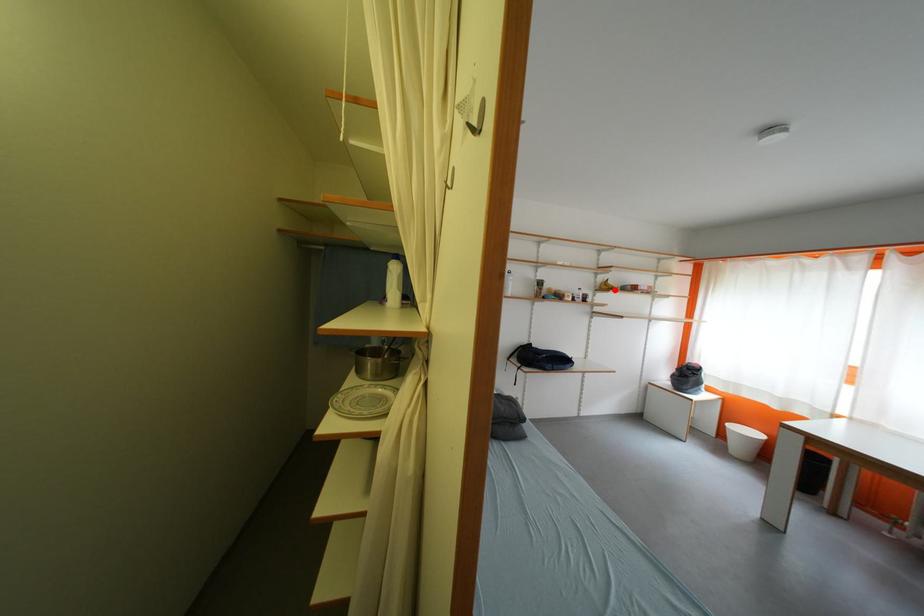
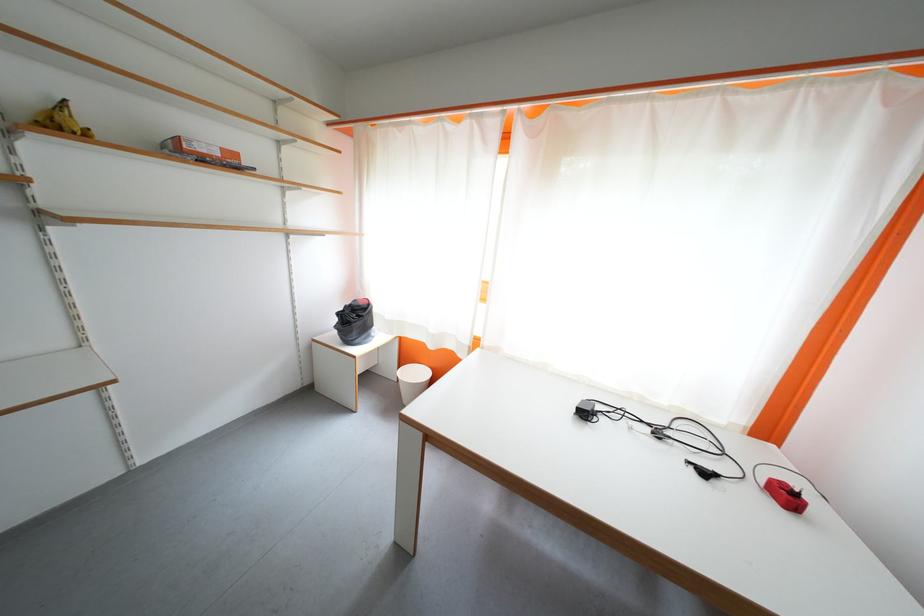
Where in the second image is the point corresponding to the highlighted location from the first image?

(68, 129)